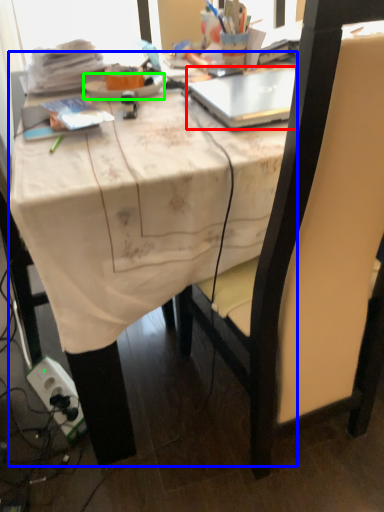
Question: Considering the real-world distances, which object is farthest from laptop (highlighted by a red box)? desk (highlighted by a blue box) or plate (highlighted by a green box)?

Choices:
 (A) desk
 (B) plate

Answer: (A)